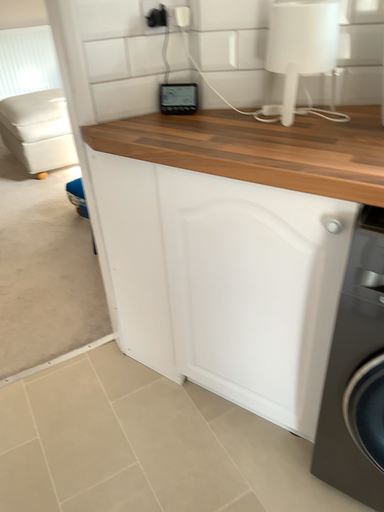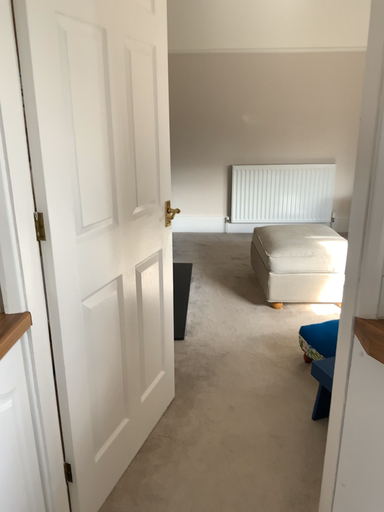
Question: How did the camera likely rotate when shooting the video?

Choices:
 (A) rotated left
 (B) rotated right

Answer: (A)